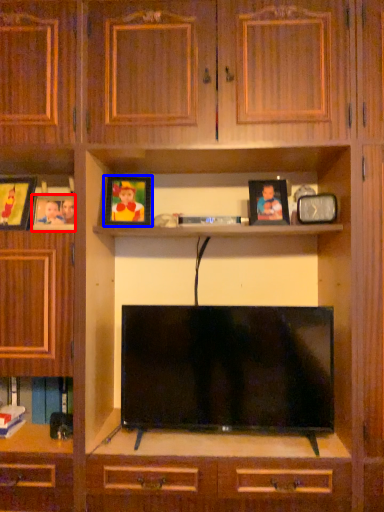
Question: Among these objects, which one is nearest to the camera, picture frame (highlighted by a red box) or picture frame (highlighted by a blue box)?

Choices:
 (A) picture frame
 (B) picture frame

Answer: (A)